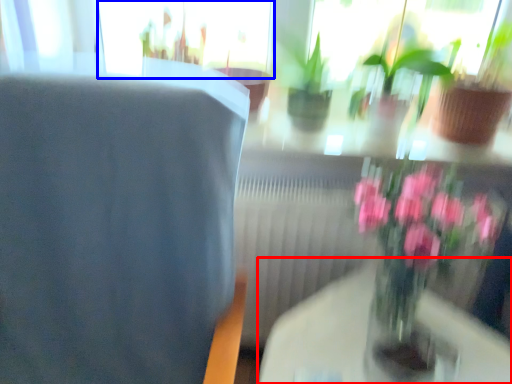
Question: Which object appears farthest to the camera in this image, round table (highlighted by a red box) or glass door (highlighted by a blue box)?

Choices:
 (A) round table
 (B) glass door

Answer: (B)